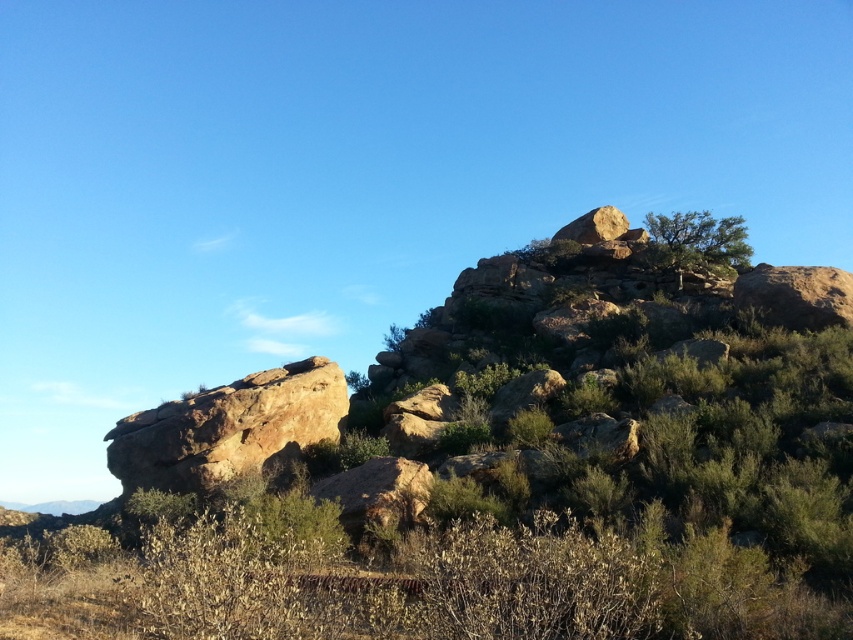
Is green shrubbery at upper center shorter than green leafy shrub at upper right?

In fact, green shrubbery at upper center may be taller than green leafy shrub at upper right.

Who is positioned more to the left, green shrubbery at upper center or green leafy shrub at upper right?

From the viewer's perspective, green shrubbery at upper center appears more on the left side.

Is point (370, 554) closer to camera compared to point (648, 232)?

Yes, point (370, 554) is in front of point (648, 232).

Find the location of a particular element. The width and height of the screenshot is (853, 640). green shrubbery at upper center is located at coordinates (494, 472).